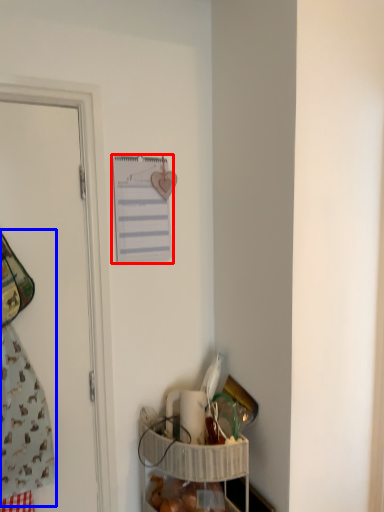
Question: Which object is closer to the camera taking this photo, journal (highlighted by a red box) or laundry (highlighted by a blue box)?

Choices:
 (A) journal
 (B) laundry

Answer: (B)